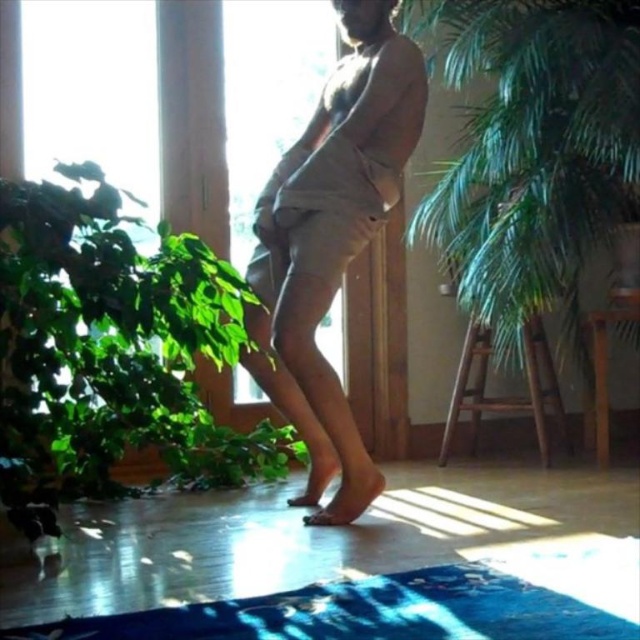
Question: Can you confirm if green leafy plant at right is positioned to the left of beige cotton shorts at center?

Choices:
 (A) no
 (B) yes

Answer: (A)

Question: Which point is farther to the camera?

Choices:
 (A) green leafy plant at lower left
 (B) blue textured yoga mat at lower center
 (C) wooden ladder at center
 (D) beige cotton shorts at center

Answer: (C)

Question: Which object is positioned farthest from the wooden ladder at center?

Choices:
 (A) beige cotton shorts at center
 (B) green leafy plant at lower left

Answer: (B)

Question: Can you confirm if green leafy plant at lower left is positioned above blue textured yoga mat at lower center?

Choices:
 (A) no
 (B) yes

Answer: (B)

Question: Among these objects, which one is farthest from the camera?

Choices:
 (A) green leafy plant at lower left
 (B) green leafy plant at right
 (C) beige cotton shorts at center
 (D) wooden ladder at center

Answer: (D)

Question: Can you confirm if beige cotton shorts at center is positioned below wooden ladder at center?

Choices:
 (A) yes
 (B) no

Answer: (B)